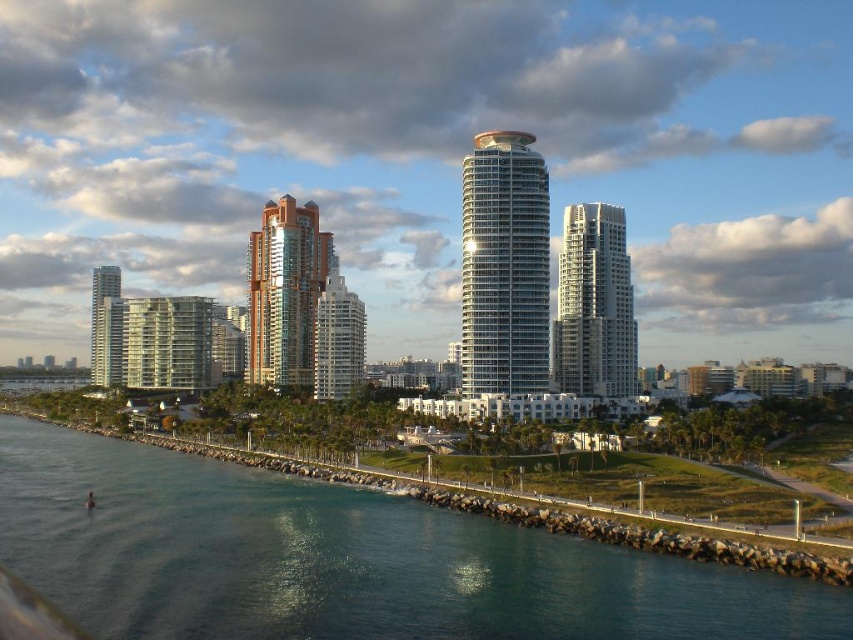
Is point (375, 509) closer to camera compared to point (100, 276)?

Yes, it is.

Can you confirm if clear blue water at lower left is thinner than matte glass skyscraper at left?

Incorrect, clear blue water at lower left's width is not less than matte glass skyscraper at left's.

Is point (836, 637) positioned after point (97, 312)?

No, (836, 637) is in front of (97, 312).

At what (x,y) coordinates should I click in order to perform the action: click on clear blue water at lower left. Please return your answer as a coordinate pair (x, y). Looking at the image, I should click on (343, 560).

Can you confirm if glassy reflective building at center is wider than matte glass skyscraper at left?

No, glassy reflective building at center is not wider than matte glass skyscraper at left.

Which is more to the right, glassy reflective building at center or matte glass skyscraper at left?

glassy reflective building at center is more to the right.

At what (x,y) coordinates should I click in order to perform the action: click on glassy reflective building at center. Please return your answer as a coordinate pair (x, y). The width and height of the screenshot is (853, 640). Looking at the image, I should click on (337, 333).

Locate an element on the screen. This screenshot has height=640, width=853. glassy reflective building at center is located at coordinates (337, 333).

Which is more to the left, white glass building at center or matte glass skyscraper at left?

From the viewer's perspective, matte glass skyscraper at left appears more on the left side.

Where is `white glass building at center`? white glass building at center is located at coordinates (595, 305).

Identify the location of white glass building at center. The width and height of the screenshot is (853, 640). (595, 305).